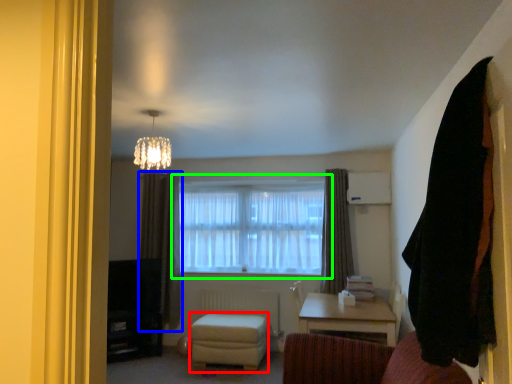
Question: Which is nearer to the stool (highlighted by a red box)? curtain (highlighted by a blue box) or window (highlighted by a green box).

Choices:
 (A) curtain
 (B) window

Answer: (A)